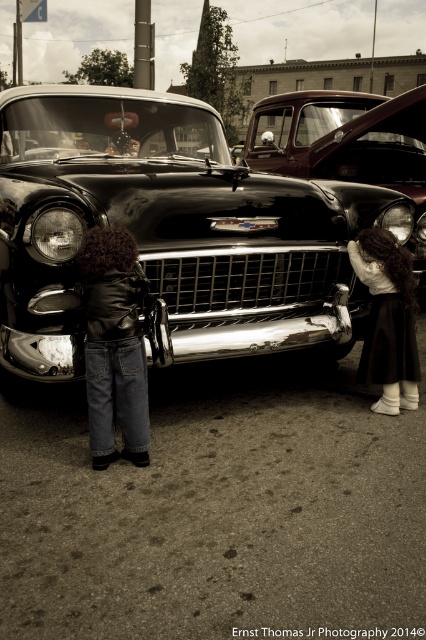
You are a photographer at the car show and want to capture both the shiny black car at center and the shiny chrome pickup truck at center in a single frame. Given that your camera has a fixed focal length, which vehicle should you position closer to the camera to ensure both fit within the frame?

The shiny black car at center is wider than the shiny chrome pickup truck at center. To fit both in the frame, position the wider shiny black car at center closer to the camera so that its apparent size matches the pickup truck at a distance, allowing both to fit within the frame.

What is located at the coordinates point (170,232) in the image?

The shiny black car at center is located at point (170,232) in the image.

You are a photographer trying to capture a detailed shot of the Chevrolet car emblem. You notice two points marked in the scene. Which point is closer to your camera lens? Please choose between point A and point B, where point A is point (134, 228) and point B is point (256, 124).

Point A, which is point (134, 228), is closer to the camera lens than point B, point (256, 124).